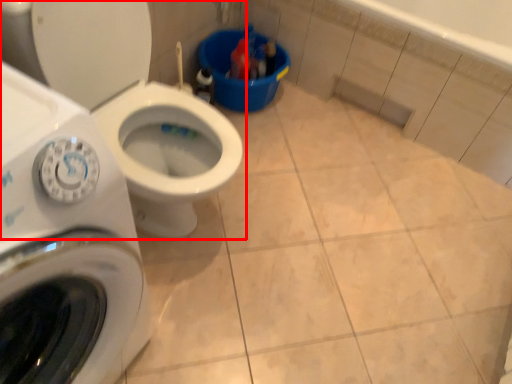
Question: Observing the image, what is the correct spatial positioning of toilet (annotated by the red box) in reference to washing machine?

Choices:
 (A) left
 (B) right

Answer: (B)